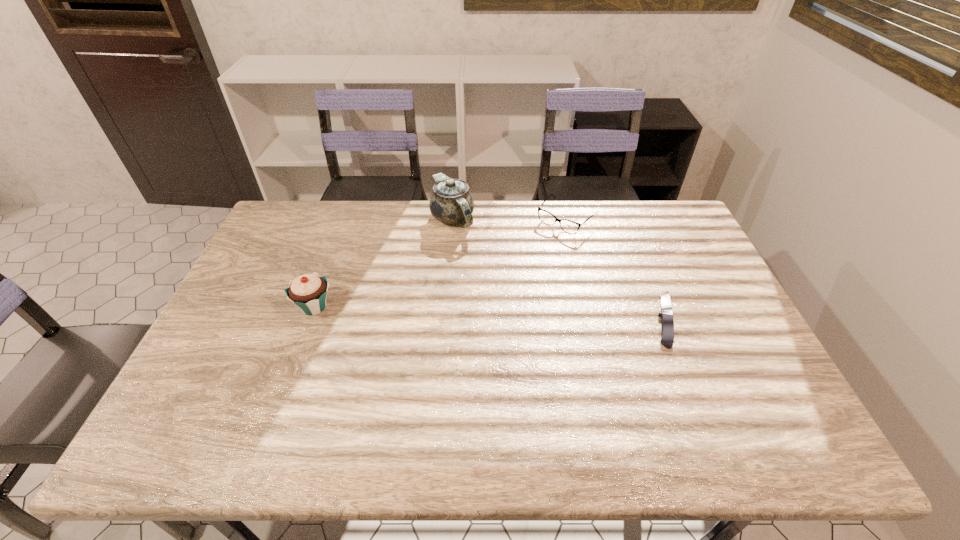
Locate an element on the screen. Image resolution: width=960 pixels, height=540 pixels. free spot located 0.120m from the spout of the tallest object is located at coordinates (461, 261).

Locate an element on the screen. Image resolution: width=960 pixels, height=540 pixels. vacant space located from the spout of the tallest object is located at coordinates (458, 251).

Identify the location of vacant space located 0.280m from the spout of the tallest object. This screenshot has width=960, height=540. (468, 298).

Where is `free space located 0.070m on the front-facing side of the third object from left to right`? This screenshot has width=960, height=540. free space located 0.070m on the front-facing side of the third object from left to right is located at coordinates (541, 245).

Find the location of a particular element. vacant space located on the front-facing side of the third object from left to right is located at coordinates (508, 278).

I want to click on blank area located 0.090m on the front-facing side of the third object from left to right, so click(538, 247).

Locate an element on the screen. Image resolution: width=960 pixels, height=540 pixels. chinaware present at the far edge is located at coordinates (451, 202).

Locate an element on the screen. spectacles positioned at the far edge is located at coordinates (568, 226).

The height and width of the screenshot is (540, 960). I want to click on vacant space at the far edge of the desktop, so click(x=572, y=218).

Locate an element on the screen. Image resolution: width=960 pixels, height=540 pixels. vacant space at the near edge of the desktop is located at coordinates pyautogui.click(x=668, y=380).